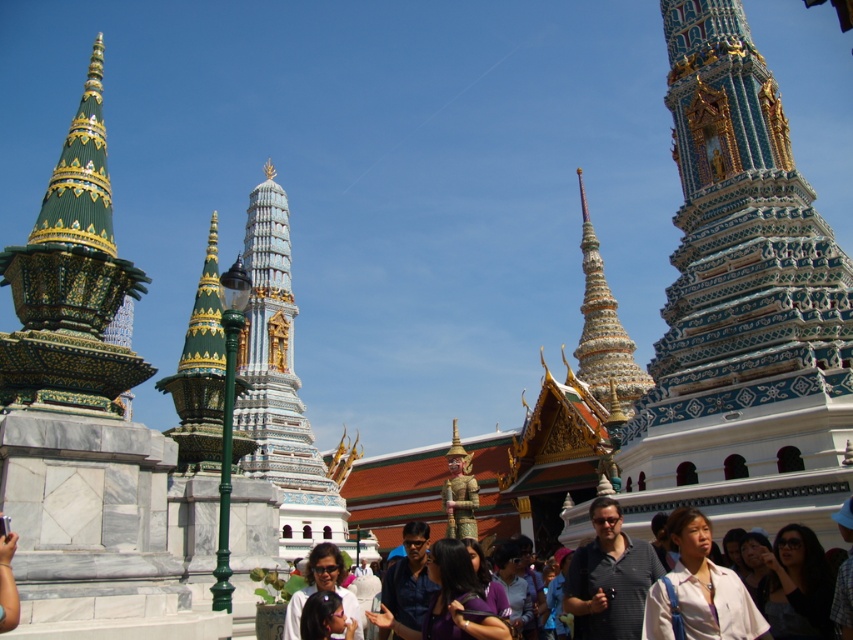
Question: Which point appears closest to the camera in this image?

Choices:
 (A) (714, 621)
 (B) (585, 344)
 (C) (323, 628)

Answer: (A)

Question: Considering the relative positions of dark blue shirt at center and matte white shirt at center in the image provided, where is dark blue shirt at center located with respect to matte white shirt at center?

Choices:
 (A) right
 (B) left

Answer: (A)

Question: Which of these objects is positioned farthest from the blue mosaic temple at center?

Choices:
 (A) matte white shirt at center
 (B) polished white marble tower at center
 (C) green mosaic stupa at left
 (D) dark gray striped shirt at center

Answer: (B)

Question: From the image, what is the correct spatial relationship of dark gray striped shirt at center in relation to dark blue shirt at lower right?

Choices:
 (A) below
 (B) above

Answer: (B)

Question: Does blue mosaic temple at center appear on the left side of white matte shirt at lower center?

Choices:
 (A) no
 (B) yes

Answer: (A)

Question: Which object is the farthest from the dark gray striped shirt at center?

Choices:
 (A) matte white shirt at center
 (B) dark blue shirt at lower right
 (C) blue mosaic temple at center

Answer: (C)